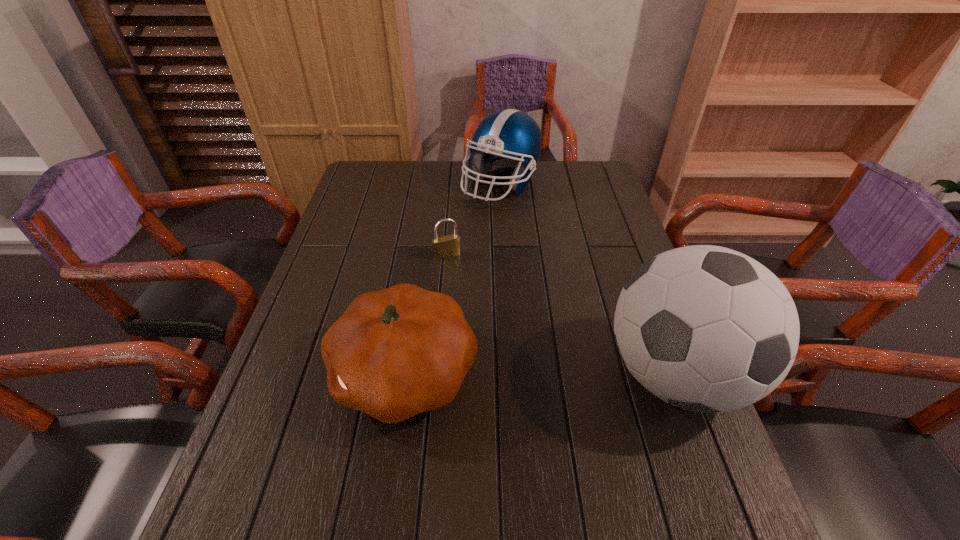
Where is `pumpkin`? pumpkin is located at coordinates (394, 353).

Where is `the rightmost object`? This screenshot has height=540, width=960. the rightmost object is located at coordinates (705, 328).

At what (x,y) coordinates should I click in order to perform the action: click on soccer ball. Please return your answer as a coordinate pair (x, y). This screenshot has width=960, height=540. Looking at the image, I should click on (705, 328).

The width and height of the screenshot is (960, 540). In order to click on the shortest object in this screenshot , I will do `click(447, 246)`.

The width and height of the screenshot is (960, 540). I want to click on padlock, so click(x=447, y=246).

Identify the location of football helmet. (508, 137).

At what (x,y) coordinates should I click in order to perform the action: click on vacant space located 0.110m on the front face of the pumpkin. Please return your answer as a coordinate pair (x, y). This screenshot has height=540, width=960. Looking at the image, I should click on (283, 373).

You are a GUI agent. You are given a task and a screenshot of the screen. Output one action in this format:
    pyautogui.click(x=<x>, y=<y>)
    Task: Click on the vacant space located 0.090m on the left of the tallest object
    The image size is (960, 540).
    Given the screenshot: What is the action you would take?
    pyautogui.click(x=563, y=375)

Where is `vacant space located 0.080m on the front-facing side of the third nearest object`? vacant space located 0.080m on the front-facing side of the third nearest object is located at coordinates (461, 278).

In order to click on free space located on the front-facing side of the third nearest object in this screenshot , I will do `click(486, 326)`.